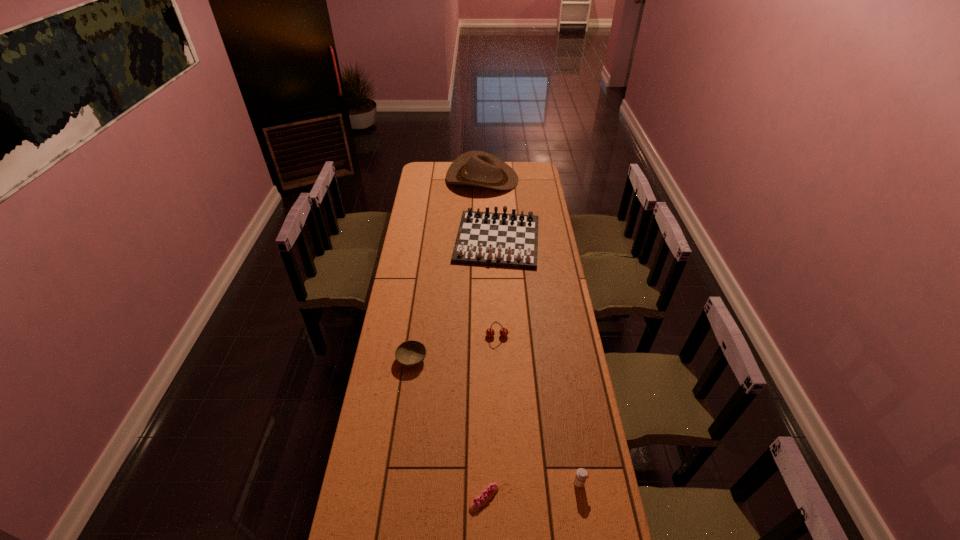
I want to click on vacant space situated with a star on the front of the farthest object, so click(x=423, y=179).

Find the location of a particular element. The width and height of the screenshot is (960, 540). vacant space located on the left of the second farthest object is located at coordinates (432, 240).

I want to click on blank space located with stems pointing upwards on the third farthest object, so click(x=499, y=394).

Locate an element on the screen. This screenshot has width=960, height=540. free space located on the back of the medicine is located at coordinates (568, 411).

Locate an element on the screen. Image resolution: width=960 pixels, height=540 pixels. free space located on the right of the second shortest object is located at coordinates (497, 359).

This screenshot has width=960, height=540. Find the location of `vacant region located 0.300m on the left of the shortest object`. vacant region located 0.300m on the left of the shortest object is located at coordinates (373, 498).

I want to click on object that is at the far edge, so click(x=475, y=168).

Where is `object present at the left edge`? object present at the left edge is located at coordinates [x=410, y=353].

I want to click on cowboy hat present at the right edge, so click(475, 168).

Identify the location of chessboard at the right edge. (485, 238).